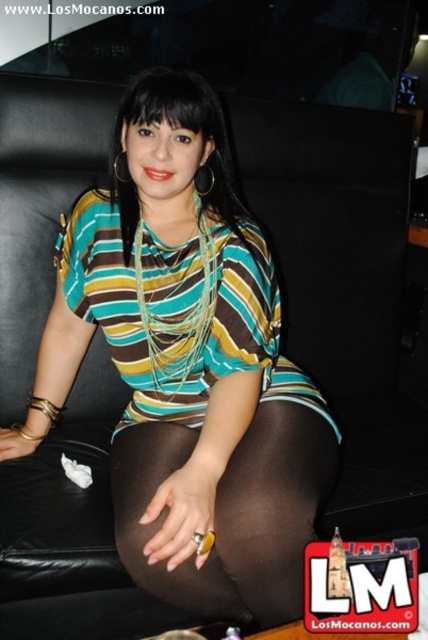
Question: Which point is closer to the camera?

Choices:
 (A) pyautogui.click(x=282, y=589)
 (B) pyautogui.click(x=214, y=540)

Answer: (B)

Question: Observing the image, what is the correct spatial positioning of striped fabric shirt at center in reference to brown sheer tights at center?

Choices:
 (A) left
 (B) right

Answer: (A)

Question: Which of the following is the closest to the observer?

Choices:
 (A) (145, 531)
 (B) (261, 582)

Answer: (B)

Question: Does striped fabric shirt at center have a smaller size compared to brown sheer tights at center?

Choices:
 (A) yes
 (B) no

Answer: (B)

Question: Can you confirm if striped fabric shirt at center is positioned to the left of brown sheer tights at center?

Choices:
 (A) no
 (B) yes

Answer: (B)